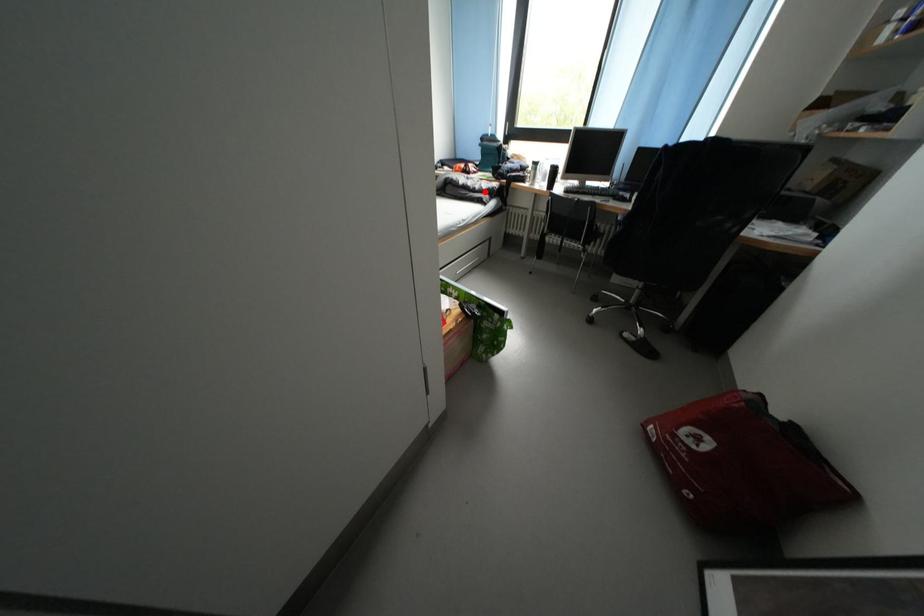
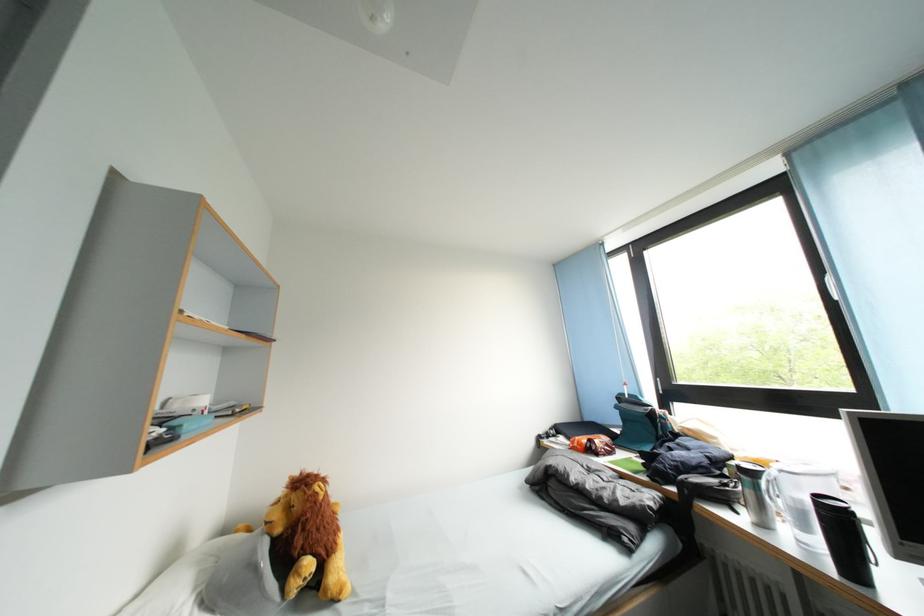
Question: I am providing you with two images of the same scene from different viewpoints. Image1 has a red point marked. In image2, the corresponding 3D location appears at what relative position? Reply with the corresponding letter.

Choices:
 (A) Closer
 (B) Farther

Answer: (B)